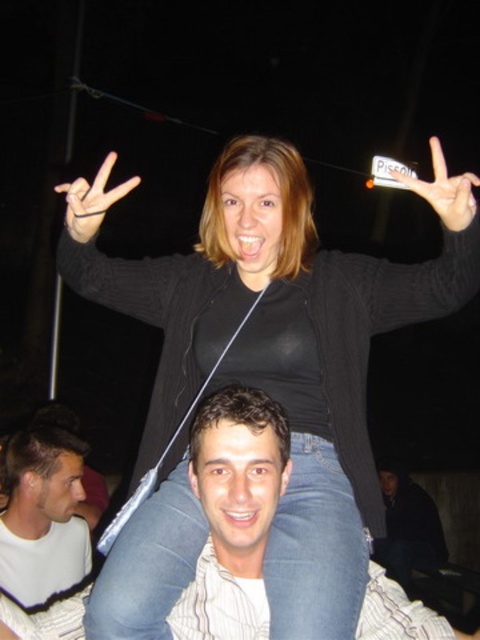
Is white matte sign at upper center taller than black rubber band at upper left?

Yes.

Who is positioned more to the right, white matte sign at upper center or black rubber band at upper left?

white matte sign at upper center

At what (x,y) coordinates should I click in order to perform the action: click on white matte sign at upper center. Please return your answer as a coordinate pair (x, y). This screenshot has height=640, width=480. Looking at the image, I should click on (444, 189).

Is point (142, 632) more distant than point (392, 529)?

That is False.

Can you confirm if black sweater at center is thinner than dark blue jeans at lower right?

No, black sweater at center is not thinner than dark blue jeans at lower right.

The width and height of the screenshot is (480, 640). What do you see at coordinates (282, 356) in the screenshot? I see `black sweater at center` at bounding box center [282, 356].

Where is `black sweater at center`? The image size is (480, 640). black sweater at center is located at coordinates (282, 356).

Can you confirm if white matte shirt at lower left is shorter than black rubber band at upper left?

No.

Does white matte shirt at lower left have a greater height compared to black rubber band at upper left?

Indeed, white matte shirt at lower left has a greater height compared to black rubber band at upper left.

The width and height of the screenshot is (480, 640). Find the location of `white matte shirt at lower left`. white matte shirt at lower left is located at coordinates (43, 515).